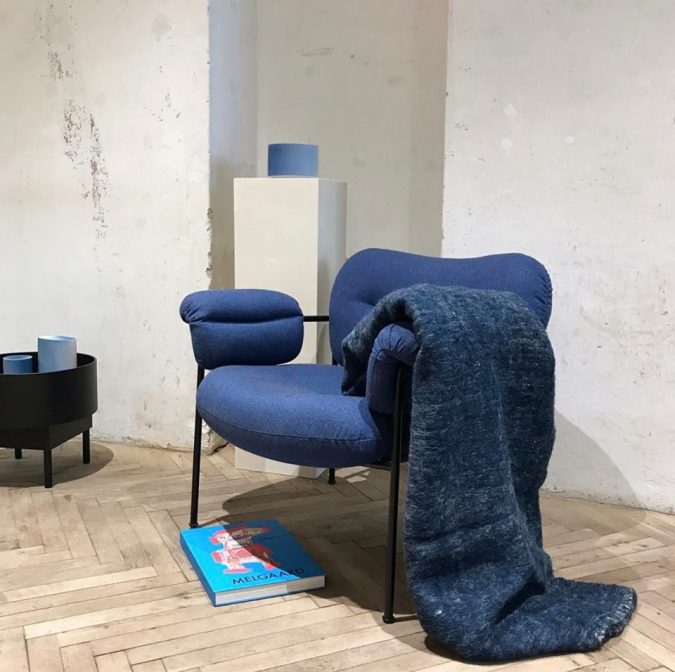
Where is `floor`? This screenshot has width=675, height=672. floor is located at coordinates (117, 595).